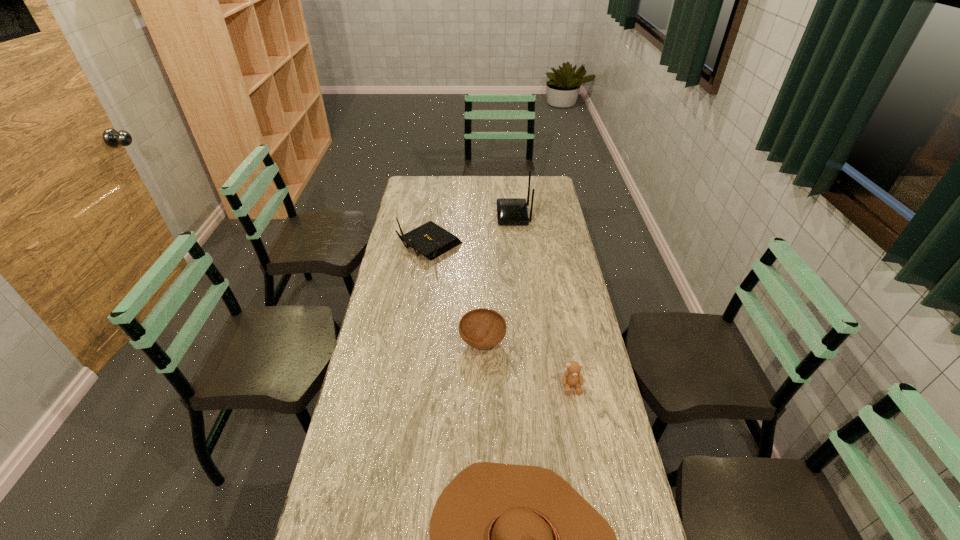
Locate an element on the screen. The width and height of the screenshot is (960, 540). free space between the shorter router and the bowl is located at coordinates (456, 293).

The width and height of the screenshot is (960, 540). I want to click on unoccupied position between the tallest object and the third nearest object, so click(x=498, y=279).

The width and height of the screenshot is (960, 540). Identify the location of vacant point located between the second nearest object and the third nearest object. (527, 364).

Identify the location of free space between the bowl and the shorter router. This screenshot has height=540, width=960. (456, 293).

Locate which object ranks in proximity to the cowboy hat. Please provide its 2D coordinates. Your answer should be formatted as a tuple, i.e. [(x, y)], where the tuple contains the x and y coordinates of a point satisfying the conditions above.

[(572, 377)]

Identify the location of object that stands as the closest to the teddy bear. The height and width of the screenshot is (540, 960). (482, 328).

Locate an element on the screen. The height and width of the screenshot is (540, 960). vacant space that satisfies the following two spatial constraints: 1. on the front-facing side of the tallest object; 2. on the front side of the third nearest object is located at coordinates (526, 342).